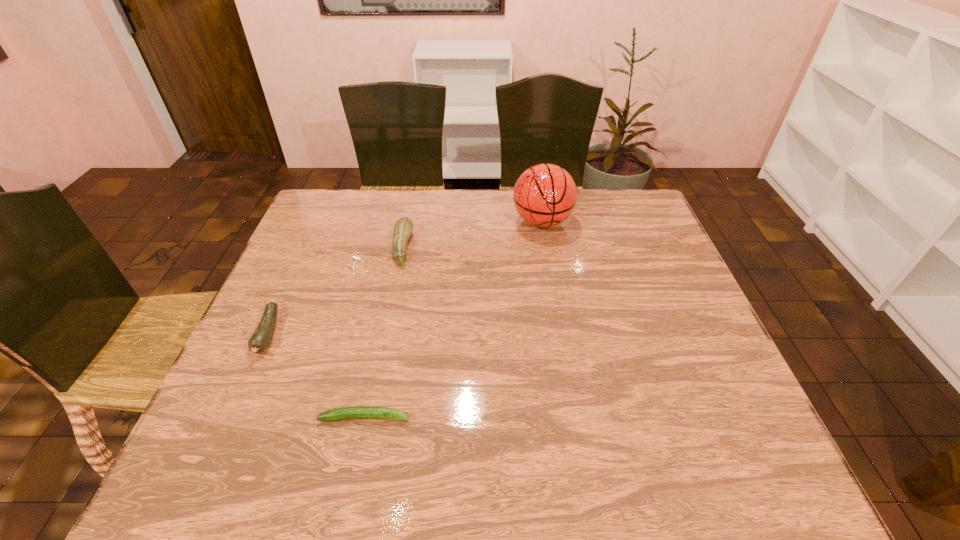
The height and width of the screenshot is (540, 960). I want to click on basketball, so click(545, 195).

Find the location of a particular element. The width and height of the screenshot is (960, 540). the tallest object is located at coordinates (545, 195).

Identify the location of the third shortest object. This screenshot has width=960, height=540. (403, 228).

Locate an element on the screen. the farthest zucchini is located at coordinates (x=403, y=228).

The image size is (960, 540). I want to click on the third farthest object, so click(262, 336).

At what (x,y) coordinates should I click in order to perform the action: click on the second tallest zucchini. Please return your answer as a coordinate pair (x, y). The image size is (960, 540). Looking at the image, I should click on (262, 336).

Locate an element on the screen. The image size is (960, 540). the nearest object is located at coordinates (360, 412).

The width and height of the screenshot is (960, 540). I want to click on the shortest zucchini, so click(x=360, y=412).

The width and height of the screenshot is (960, 540). I want to click on vacant space positioned on the side with spill of the rightmost object, so click(x=562, y=338).

Locate an element on the screen. This screenshot has height=540, width=960. free space located 0.340m at the stem end of the tallest zucchini is located at coordinates (525, 247).